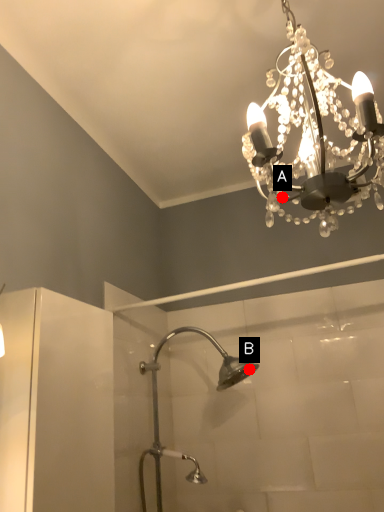
Question: Two points are circled on the image, labeled by A and B beside each circle. Which point is closer to the camera?

Choices:
 (A) A is closer
 (B) B is closer

Answer: (A)